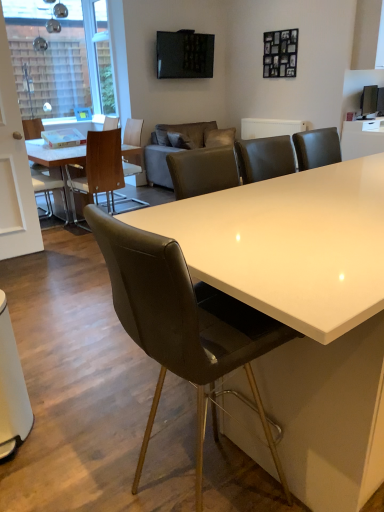
Question: Is matte wooden table at left, which appears as the 1th table when viewed from the left, positioned behind leather at center, the 1th chair from the front?

Choices:
 (A) yes
 (B) no

Answer: (A)

Question: From the image's perspective, is matte wooden table at left, which appears as the 1th table when viewed from the left, located above leather at center, placed as the fourth chair when sorted from back to front?

Choices:
 (A) no
 (B) yes

Answer: (B)

Question: Is matte wooden table at left, which appears as the 1th table when viewed from the left, next to leather at center, the 1th chair from the front, and touching it?

Choices:
 (A) yes
 (B) no

Answer: (B)

Question: Can you confirm if matte wooden table at left, placed as the 2th table when sorted from right to left, is positioned to the right of leather at center, placed as the fourth chair when sorted from back to front?

Choices:
 (A) yes
 (B) no

Answer: (B)

Question: Considering the relative sizes of matte wooden table at left, which appears as the 1th table when viewed from the left, and leather at center, the 1th chair from the front, in the image provided, is matte wooden table at left, which appears as the 1th table when viewed from the left, shorter than leather at center, the 1th chair from the front,?

Choices:
 (A) yes
 (B) no

Answer: (A)

Question: Is matte wooden table at left, placed as the 2th table when sorted from right to left, taller than leather at center, placed as the fourth chair when sorted from back to front?

Choices:
 (A) yes
 (B) no

Answer: (B)

Question: From a real-world perspective, is wooden chair at left, the 3th chair positioned from the back, located beneath matte wooden table at left, which appears as the 1th table when viewed from the left?

Choices:
 (A) no
 (B) yes

Answer: (A)

Question: Is the position of wooden chair at left, the second chair viewed from the front, less distant than that of matte wooden table at left, which appears as the 1th table when viewed from the left?

Choices:
 (A) no
 (B) yes

Answer: (B)

Question: Is matte wooden table at left, placed as the 2th table when sorted from right to left, located within wooden chair at left, the 3th chair positioned from the back?

Choices:
 (A) no
 (B) yes

Answer: (A)

Question: Can you confirm if wooden chair at left, the second chair viewed from the front, is wider than matte wooden table at left, which appears as the 1th table when viewed from the left?

Choices:
 (A) no
 (B) yes

Answer: (A)

Question: Is wooden chair at left, the second chair viewed from the front, bigger than matte wooden table at left, placed as the 2th table when sorted from right to left?

Choices:
 (A) no
 (B) yes

Answer: (A)

Question: From the image's perspective, does wooden chair at left, the 3th chair positioned from the back, appear lower than matte wooden table at left, which appears as the 1th table when viewed from the left?

Choices:
 (A) no
 (B) yes

Answer: (B)

Question: Is woodenchair at left, arranged as the 1th chair when viewed from the back, taller than white leather chair at left, arranged as the 2th chair when viewed from the back?

Choices:
 (A) yes
 (B) no

Answer: (A)